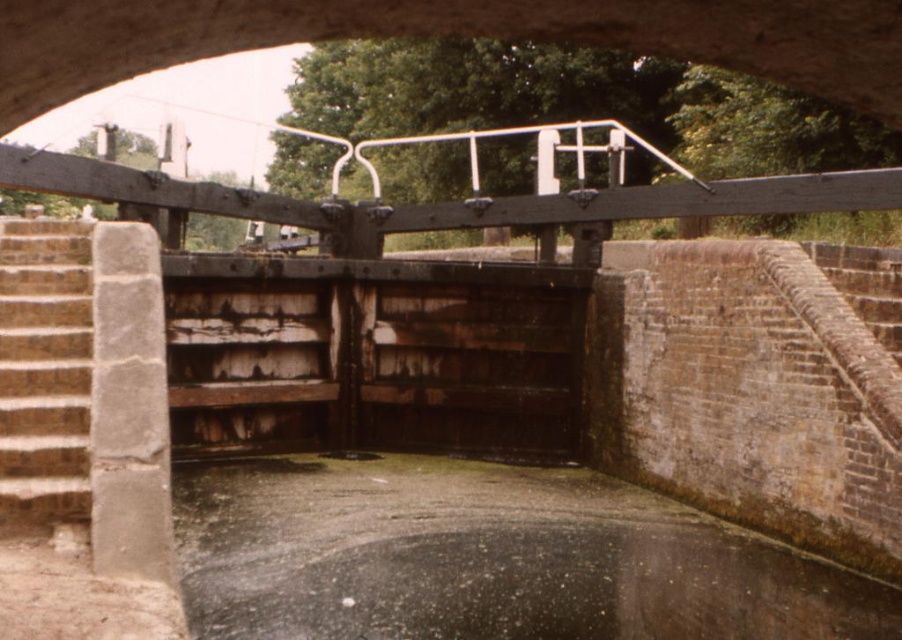
You are a maintenance worker needing to inspect the glossy concrete puddle at center. The brown stone stairs at left are your only path to reach it. Can you walk directly to the puddle without stepping into it?

The brown stone stairs at left are to the left of the glossy concrete puddle at center, so you can walk along the stairs to reach the puddle without stepping into it.

You are standing at the entrance of the canal lock and want to cross to the other side. You see the brown stone stairs at left and the glossy concrete puddle at center. Which object is nearer to you, and can you step onto the stairs to avoid the puddle?

The brown stone stairs at left is closer to the viewer than the glossy concrete puddle at center. Yes, you can step onto the brown stone stairs at left to avoid the puddle.

You are a maintenance worker needing to inspect both the brown stone stairs at left and the glossy concrete puddle at center. Which object is higher in elevation?

The brown stone stairs at left is taller than the glossy concrete puddle at center, so the brown stone stairs at left is higher in elevation.